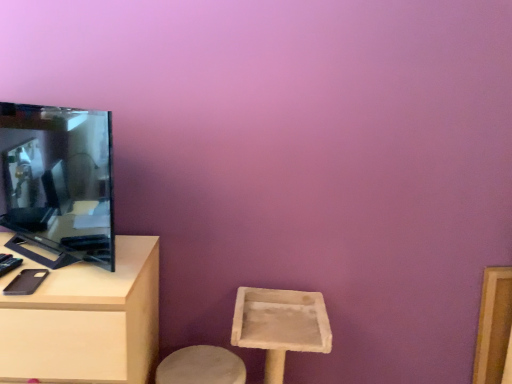
Describe the element at coordinates (58, 183) in the screenshot. I see `matte black tv at left` at that location.

The height and width of the screenshot is (384, 512). I want to click on matte black tv at left, so click(58, 183).

What do you see at coordinates (86, 321) in the screenshot?
I see `light wood table at left` at bounding box center [86, 321].

Image resolution: width=512 pixels, height=384 pixels. Find the location of `light wood table at left`. light wood table at left is located at coordinates (86, 321).

The height and width of the screenshot is (384, 512). Identify the location of matte black tv at left. (58, 183).

Looking at this image, is light wood table at left at the right side of matte black tv at left?

Incorrect, light wood table at left is not on the right side of matte black tv at left.

Between light wood table at left and matte black tv at left, which one is positioned in front?

matte black tv at left is more forward.

Is point (104, 342) more distant than point (52, 202)?

No, (104, 342) is in front of (52, 202).

From the image's perspective, which one is positioned higher, light wood table at left or matte black tv at left?

matte black tv at left appears higher in the image.

From a real-world perspective, does light wood table at left stand above matte black tv at left?

Actually, light wood table at left is physically below matte black tv at left in the real world.

Based on the photo, between light wood table at left and matte black tv at left, which one has smaller width?

Thinner between the two is matte black tv at left.

Who is taller, light wood table at left or matte black tv at left?

light wood table at left is taller.

Between light wood table at left and matte black tv at left, which one has smaller size?

matte black tv at left.

Can we say light wood table at left lies outside matte black tv at left?

light wood table at left lies outside matte black tv at left's area.

Are light wood table at left and matte black tv at left beside each other?

They are not placed beside each other.

Is light wood table at left facing towards matte black tv at left?

No, light wood table at left is not oriented towards matte black tv at left.

Measure the distance between light wood table at left and matte black tv at left.

A distance of 8.90 inches exists between light wood table at left and matte black tv at left.

Find the location of `table that appears on the left of matte black tv at left`. table that appears on the left of matte black tv at left is located at coordinates point(86,321).

Considering the relative positions of matte black tv at left and light wood table at left in the image provided, is matte black tv at left to the right of light wood table at left from the viewer's perspective?

Correct, you'll find matte black tv at left to the right of light wood table at left.

Which object is further away from the camera taking this photo, matte black tv at left or light wood table at left?

light wood table at left is behind.

Does point (75, 155) lie behind point (74, 342)?

Yes, it is.

From the image's perspective, which is above, matte black tv at left or light wood table at left?

From the image's view, matte black tv at left is above.

From a real-world perspective, who is located lower, matte black tv at left or light wood table at left?

From a 3D spatial view, light wood table at left is below.

Between matte black tv at left and light wood table at left, which one has larger width?

light wood table at left.

Considering the sizes of matte black tv at left and light wood table at left in the image, is matte black tv at left taller or shorter than light wood table at left?

matte black tv at left is shorter than light wood table at left.

Can you confirm if matte black tv at left is smaller than light wood table at left?

Yes, matte black tv at left is smaller than light wood table at left.

Is matte black tv at left completely or partially outside of light wood table at left?

Yes, matte black tv at left is located beyond the bounds of light wood table at left.

Are matte black tv at left and light wood table at left making contact?

There is a gap between matte black tv at left and light wood table at left.

Does matte black tv at left turn towards light wood table at left?

No, matte black tv at left is not aimed at light wood table at left.

Measure the distance between matte black tv at left and light wood table at left.

They are 22.61 centimeters apart.

This screenshot has width=512, height=384. I want to click on television lying above the light wood table at left (from the image's perspective), so click(x=58, y=183).

In the image, there is a matte black tv at left. Identify the location of table below it (from a real-world perspective). (86, 321).

Find the location of `television above the light wood table at left (from the image's perspective)`. television above the light wood table at left (from the image's perspective) is located at coordinates (58, 183).